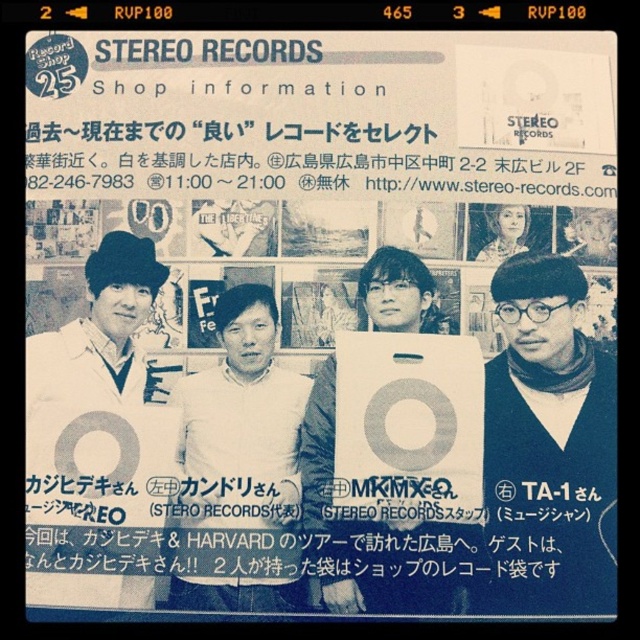
Question: Which object is farther from the camera taking this photo?

Choices:
 (A) matte black sweater at right
 (B) white matte box at center

Answer: (B)

Question: Which of the following is the closest to the observer?

Choices:
 (A) matte black sweater at right
 (B) white matte box at center
 (C) white matte hat at upper left

Answer: (A)

Question: Which of the following is the closest to the observer?

Choices:
 (A) (579, 499)
 (B) (70, 365)
 (C) (260, 364)

Answer: (A)

Question: Is white cotton shirt at center further to the viewer compared to white matte hat at upper left?

Choices:
 (A) no
 (B) yes

Answer: (A)

Question: Observing the image, what is the correct spatial positioning of matte black sweater at right in reference to white matte box at center?

Choices:
 (A) above
 (B) below

Answer: (B)

Question: Is matte black sweater at right positioned behind white cotton shirt at center?

Choices:
 (A) yes
 (B) no

Answer: (B)